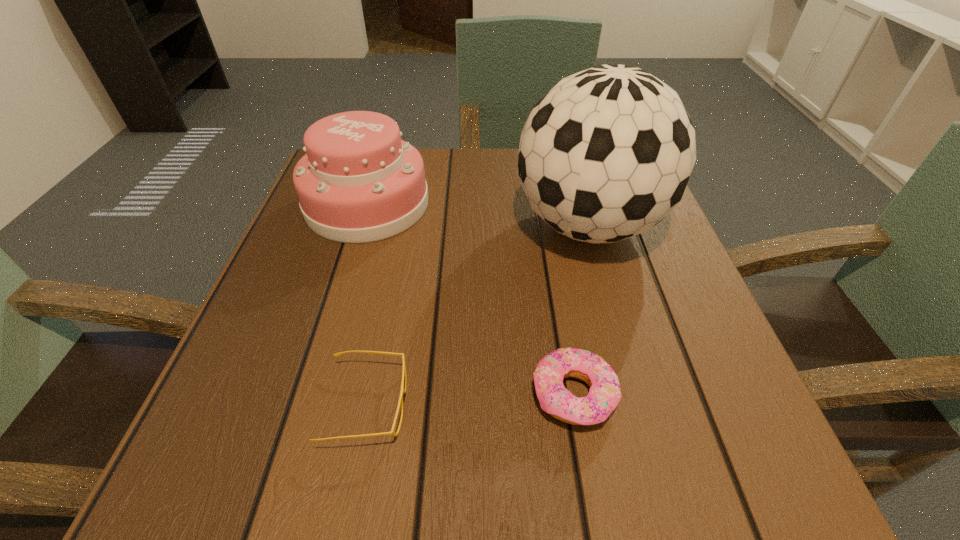
What are the coordinates of `soccer ball` in the screenshot? It's located at (606, 154).

Image resolution: width=960 pixels, height=540 pixels. I want to click on the third shortest object, so click(x=358, y=182).

You are a GUI agent. You are given a task and a screenshot of the screen. Output one action in this format:
    pyautogui.click(x=<x>, y=<y>)
    Task: Click on the doughnut
    This screenshot has height=540, width=960.
    Given the screenshot: What is the action you would take?
    pyautogui.click(x=604, y=394)

Find the location of `spectacles`. spectacles is located at coordinates (403, 389).

You are a GUI agent. You are given a task and a screenshot of the screen. Output one action in this format:
    pyautogui.click(x=<x>, y=<y>)
    Task: Click on the free space located on the front of the tallest object
    
    Given the screenshot: What is the action you would take?
    pyautogui.click(x=619, y=338)

Identify the location of free spot located on the right of the birthday cake. Image resolution: width=960 pixels, height=540 pixels. (553, 204).

The width and height of the screenshot is (960, 540). What are the coordinates of `vacant space located 0.340m on the left of the doughnut` in the screenshot? It's located at (286, 395).

Where is `free region located in front of the lenses of the spectacles`? This screenshot has height=540, width=960. free region located in front of the lenses of the spectacles is located at coordinates (685, 404).

This screenshot has width=960, height=540. What are the coordinates of `soccer ball located at the far edge` in the screenshot? It's located at (606, 154).

In order to click on birthday cake situated at the far edge in this screenshot , I will do `click(358, 182)`.